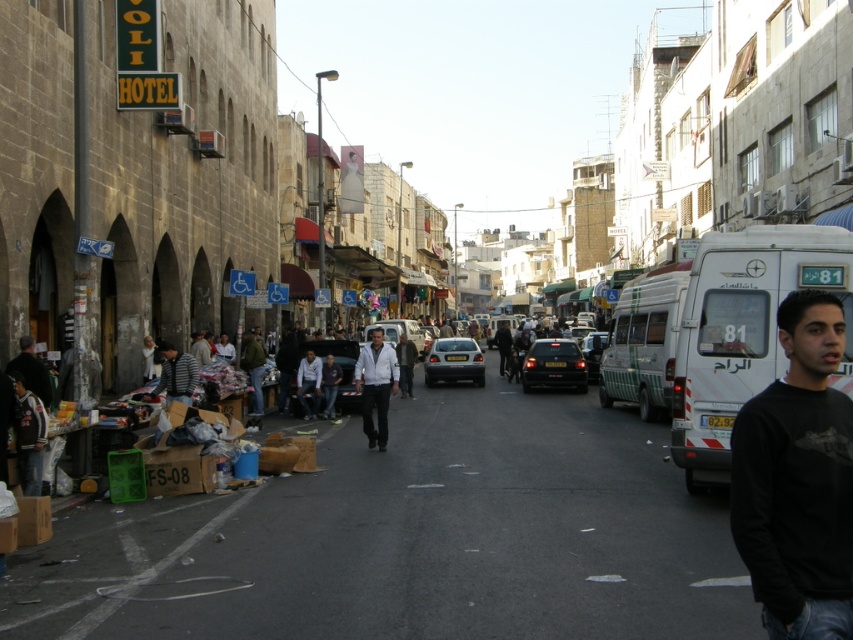
Question: Based on their relative distances, which object is nearer to the striped cotton shirt at lower left?

Choices:
 (A) green striped van at center
 (B) matte white car at center
 (C) black glossy car at center

Answer: (A)

Question: Which of the following is the closest to the observer?

Choices:
 (A) silver metallic sedan at center
 (B) dark gray jacket at center

Answer: (A)

Question: Does black matte shirt at lower right appear under striped cotton shirt at lower left?

Choices:
 (A) yes
 (B) no

Answer: (B)

Question: Is shiny black car at center positioned in front of dark gray jacket at lower left?

Choices:
 (A) no
 (B) yes

Answer: (A)

Question: Which point is farther from the camera taking this photo?

Choices:
 (A) (596, 365)
 (B) (32, 340)

Answer: (A)

Question: Observing the image, what is the correct spatial positioning of white matte jacket at center in reference to metallic silver car at center?

Choices:
 (A) below
 (B) above

Answer: (B)